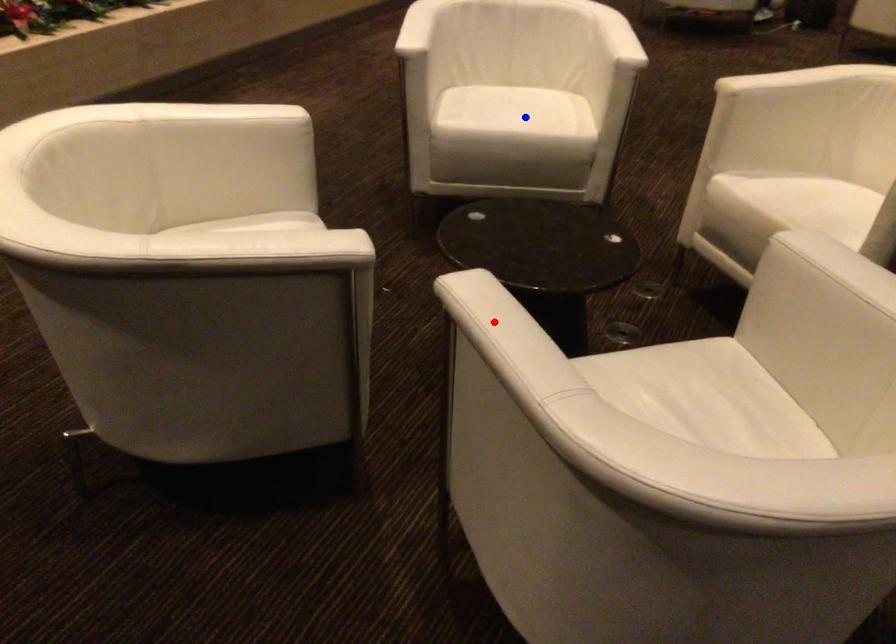
Question: Two points are marked on the image. Which point is closer to the camera?

Choices:
 (A) Blue point is closer.
 (B) Red point is closer.

Answer: (B)